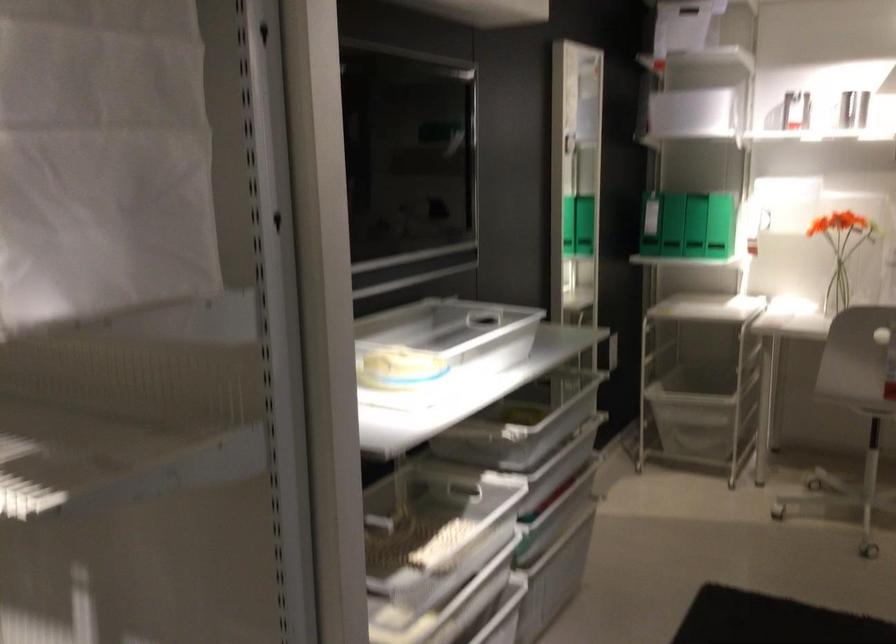
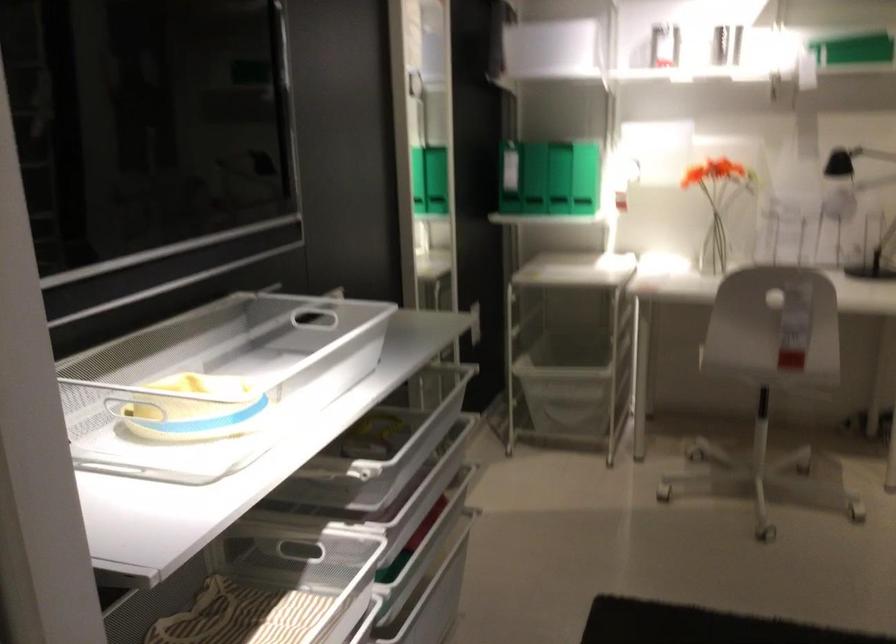
Find the pixel in the second image that matches [699,213] in the first image.

(533, 178)